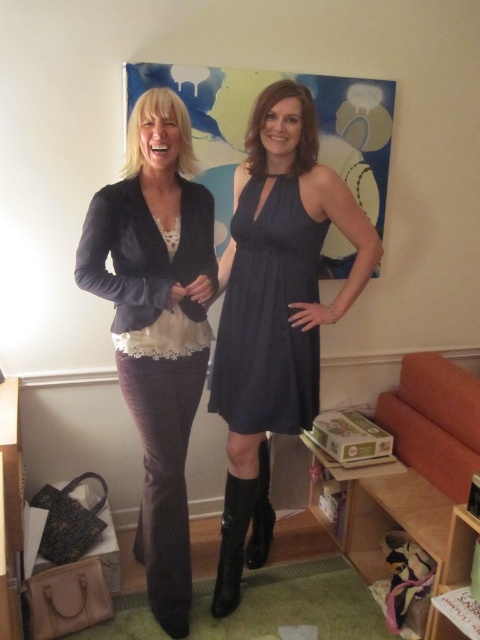
Question: Observing the image, what is the correct spatial positioning of velvet blazer at left in reference to black suede boot at lower center?

Choices:
 (A) above
 (B) below

Answer: (A)

Question: Which of the following is the closest to the observer?

Choices:
 (A) (226, 552)
 (B) (167, 248)
 (C) (259, 333)
 (D) (271, 227)

Answer: (B)

Question: Which point is farther from the camera taking this photo?

Choices:
 (A) (264, 410)
 (B) (219, 547)
 (C) (119, 230)

Answer: (B)

Question: Can you confirm if denim dress at center is positioned to the left of black leather boot at lower center?

Choices:
 (A) yes
 (B) no

Answer: (B)

Question: Does denim dress at center lie in front of velvet blazer at left?

Choices:
 (A) yes
 (B) no

Answer: (B)

Question: Among these points, which one is farthest from the camera?

Choices:
 (A) 233,548
 (B) 175,310
 (C) 238,317
 (D) 267,449

Answer: (D)